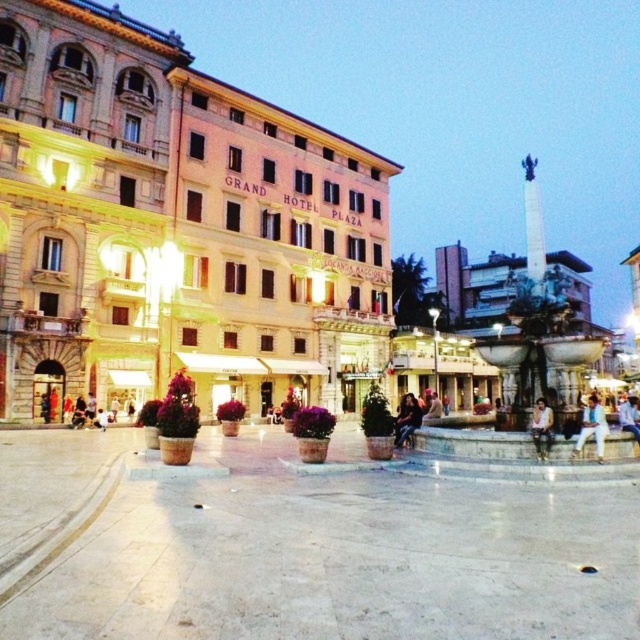
Question: Which object appears closest to the camera in this image?

Choices:
 (A) dark brown leather jacket at center
 (B) blue denim jeans at lower right
 (C) white cotton shirt at lower right
 (D) light brown leather jacket at lower right

Answer: (C)

Question: Which object appears closest to the camera in this image?

Choices:
 (A) light brown leather jacket at lower right
 (B) blue denim jeans at lower right

Answer: (A)

Question: Does dark brown leather jacket at center appear on the left side of blue denim jeans at lower right?

Choices:
 (A) yes
 (B) no

Answer: (A)

Question: Which point appears farthest from the camera in this image?

Choices:
 (A) (502, 336)
 (B) (545, 420)

Answer: (A)

Question: Does white cotton shirt at lower right appear over dark brown leather jacket at center?

Choices:
 (A) yes
 (B) no

Answer: (A)

Question: Does light brown leather jacket at lower right have a lesser width compared to blue denim jeans at lower right?

Choices:
 (A) no
 (B) yes

Answer: (B)